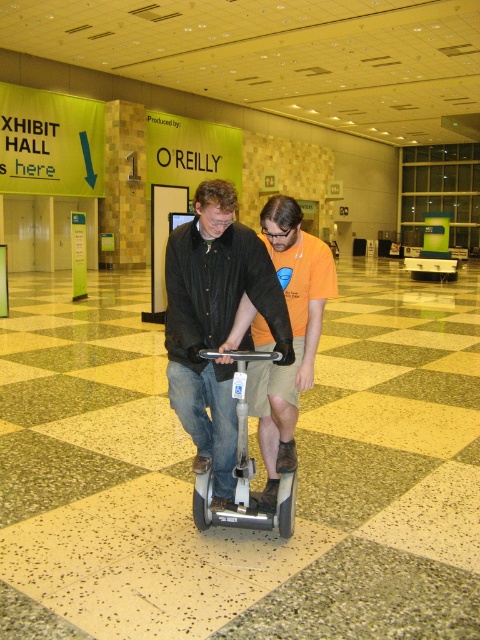
Is point (268, 228) farther from camera compared to point (291, 524)?

Yes, point (268, 228) is behind point (291, 524).

The image size is (480, 640). Describe the element at coordinates (291, 332) in the screenshot. I see `orange cotton t-shirt at center` at that location.

The image size is (480, 640). Find the location of `orange cotton t-shirt at center`. orange cotton t-shirt at center is located at coordinates (291, 332).

Based on the photo, is matte black scooter at center to the right of silver metallic scooter at center from the viewer's perspective?

No, matte black scooter at center is not to the right of silver metallic scooter at center.

Which of these two, matte black scooter at center or silver metallic scooter at center, stands taller?

matte black scooter at center

Which is in front, point (229, 253) or point (252, 461)?

Positioned in front is point (229, 253).

This screenshot has height=640, width=480. I want to click on matte black scooter at center, so click(x=215, y=323).

Does matte black scooter at center have a greater width compared to orange cotton t-shirt at center?

Indeed, matte black scooter at center has a greater width compared to orange cotton t-shirt at center.

From the picture: Which is more to the right, matte black scooter at center or orange cotton t-shirt at center?

Positioned to the right is orange cotton t-shirt at center.

Does point (222, 506) come closer to viewer compared to point (312, 241)?

Yes, it is.

Where is `matte black scooter at center`? The image size is (480, 640). matte black scooter at center is located at coordinates (215, 323).